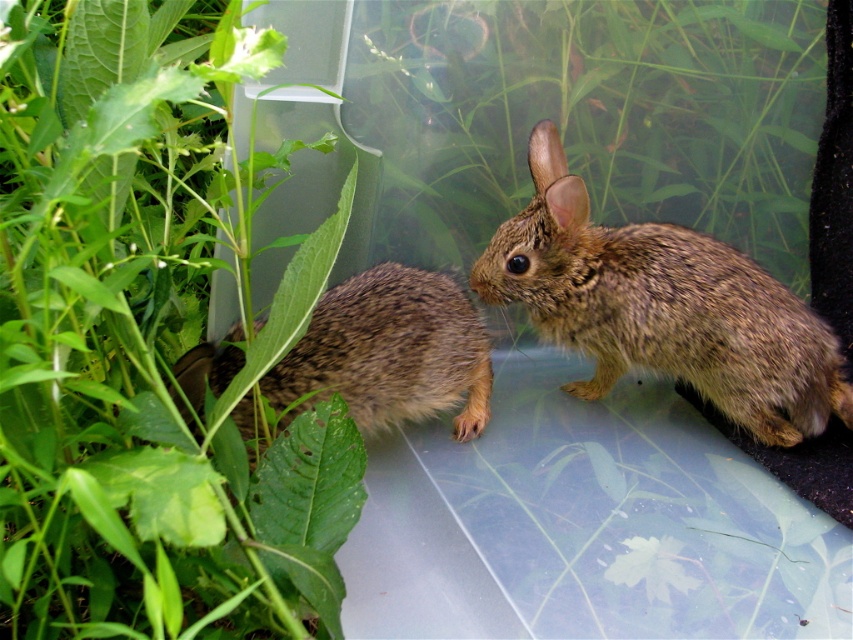
Question: Can you confirm if green leafy plant at left is wider than brown fuzzy rabbit at left?

Choices:
 (A) no
 (B) yes

Answer: (B)

Question: Which object is farther from the camera taking this photo?

Choices:
 (A) brown fuzzy rabbit at left
 (B) green leafy plant at left
 (C) brown fuzzy rabbit at center

Answer: (C)

Question: Is green leafy plant at left thinner than brown fuzzy rabbit at center?

Choices:
 (A) yes
 (B) no

Answer: (A)

Question: Which object is closer to the camera taking this photo?

Choices:
 (A) green leafy plant at left
 (B) brown fuzzy rabbit at center
 (C) brown fuzzy rabbit at left

Answer: (A)

Question: Where is green leafy plant at left located in relation to brown fuzzy rabbit at left in the image?

Choices:
 (A) left
 (B) right

Answer: (A)

Question: Which point is farther from the camera taking this photo?

Choices:
 (A) (88, 179)
 (B) (345, 298)
 (C) (660, 371)

Answer: (C)